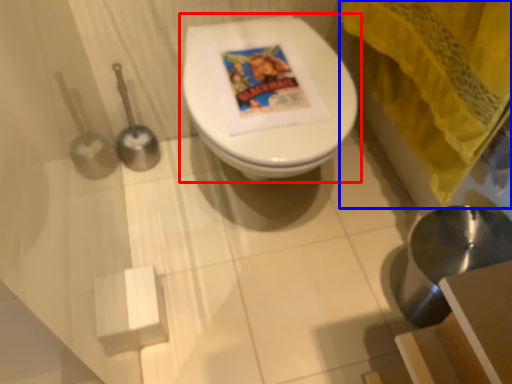
Question: Which of the following is the closest to the observer, toilet (highlighted by a red box) or curtain (highlighted by a blue box)?

Choices:
 (A) toilet
 (B) curtain

Answer: (B)